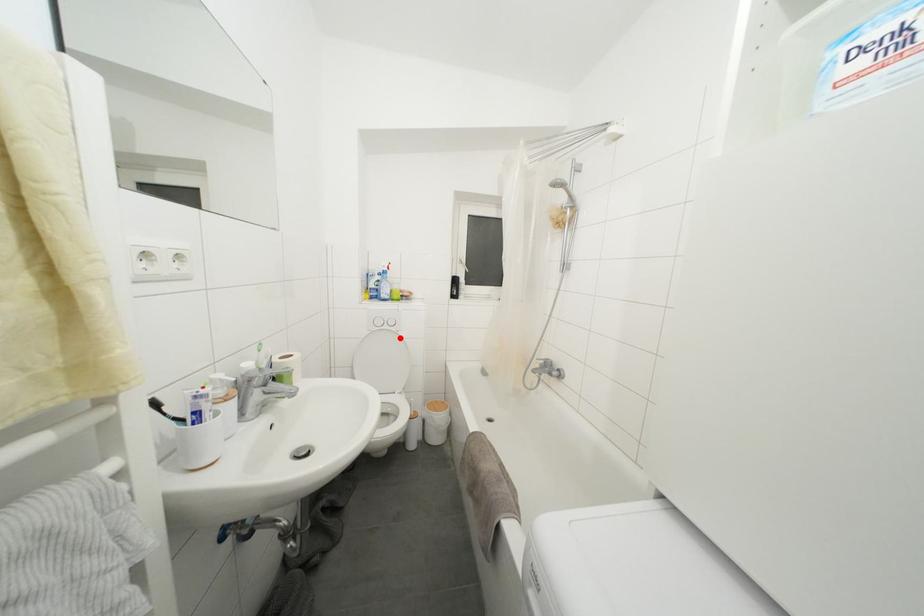
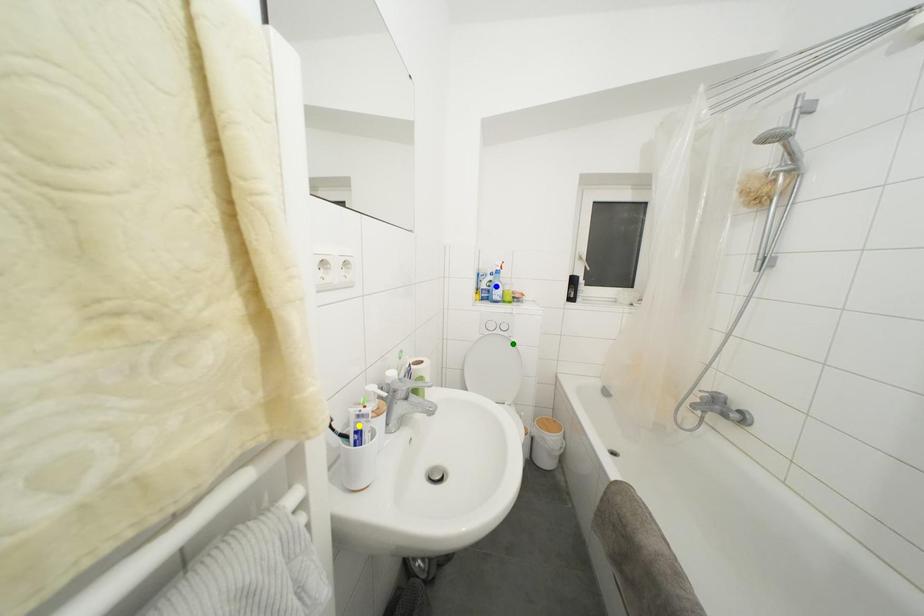
Question: I am providing you with two images of the same scene from different viewpoints. A red point is marked on the first image. You are given multiple points on the second image. Which point in image 2 represents the same 3d spot as the red point in image 1?

Choices:
 (A) yellow point
 (B) blue point
 (C) green point

Answer: (C)